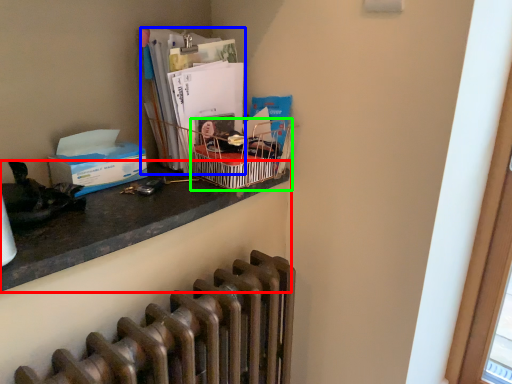
Question: Which object is the closest to the desk (highlighted by a red box)? Choose among these: magazine (highlighted by a blue box) or crate (highlighted by a green box).

Choices:
 (A) magazine
 (B) crate

Answer: (B)